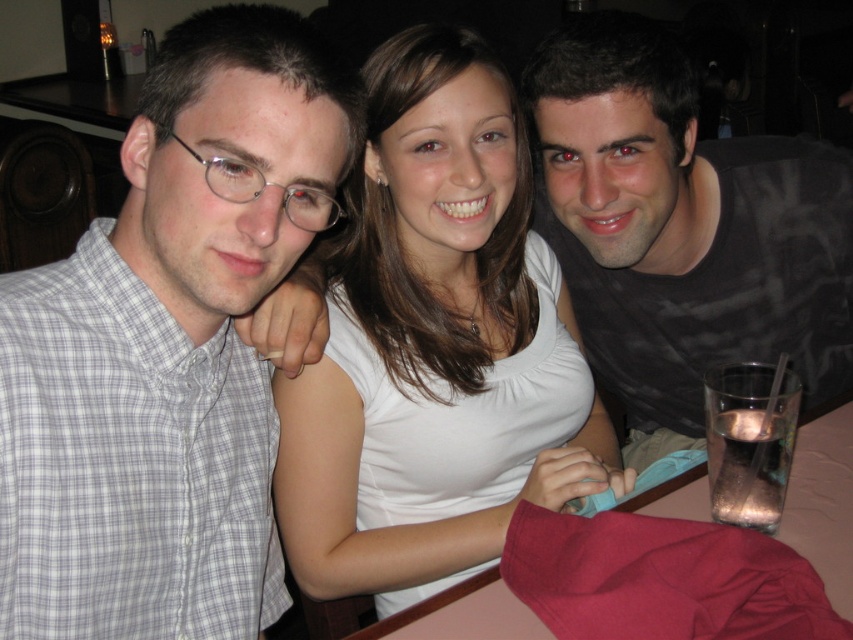
Describe the element at coordinates (436, 348) in the screenshot. I see `white smooth shirt at center` at that location.

Which is more to the left, white smooth shirt at center or smooth plastic table at lower right?

white smooth shirt at center

Locate an element on the screen. The width and height of the screenshot is (853, 640). white smooth shirt at center is located at coordinates (436, 348).

Locate an element on the screen. This screenshot has height=640, width=853. white smooth shirt at center is located at coordinates (436, 348).

Looking at this image, is white smooth shirt at center shorter than matte black shirt at upper right?

No, white smooth shirt at center is not shorter than matte black shirt at upper right.

Can you confirm if white smooth shirt at center is wider than matte black shirt at upper right?

No, white smooth shirt at center is not wider than matte black shirt at upper right.

Locate an element on the screen. This screenshot has width=853, height=640. white smooth shirt at center is located at coordinates (436, 348).

In the scene shown: Between gray checkered shirt at left and matte black shirt at upper right, which one appears on the left side from the viewer's perspective?

From the viewer's perspective, gray checkered shirt at left appears more on the left side.

Does gray checkered shirt at left have a greater height compared to matte black shirt at upper right?

Correct, gray checkered shirt at left is much taller as matte black shirt at upper right.

Does point (259, 45) lie behind point (798, 275)?

No.

Image resolution: width=853 pixels, height=640 pixels. What are the coordinates of `gray checkered shirt at left` in the screenshot? It's located at (167, 349).